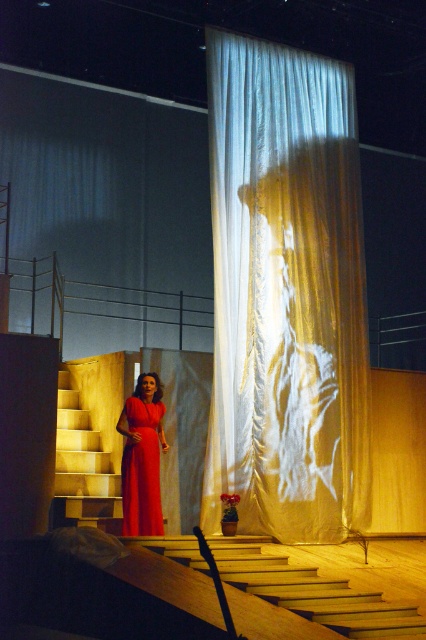
Question: Does wooden stairs at lower left appear on the right side of matte red dress at center?

Choices:
 (A) yes
 (B) no

Answer: (A)

Question: From the image, what is the correct spatial relationship of light wood stairs at lower left in relation to matte red dress at center?

Choices:
 (A) above
 (B) below

Answer: (A)

Question: Which point is closer to the camera?

Choices:
 (A) (146, 480)
 (B) (296, 602)
 (C) (356, 250)

Answer: (B)

Question: Which point is closer to the camera taking this photo?

Choices:
 (A) (314, 192)
 (B) (264, 586)
 (C) (62, 376)
 (D) (154, 372)

Answer: (B)

Question: Among these objects, which one is farthest from the camera?

Choices:
 (A) matte red dress at center
 (B) light wood stairs at lower left
 (C) wooden stairs at lower left

Answer: (B)

Question: In this image, where is wooden stairs at lower left located relative to light wood stairs at lower left?

Choices:
 (A) left
 (B) right

Answer: (B)